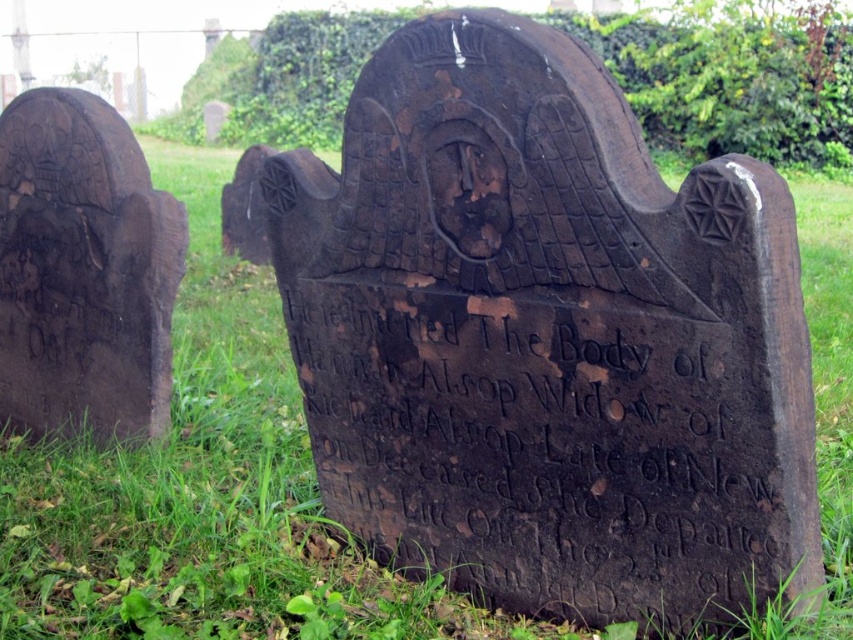
You are standing in a cemetery and notice the black stone inscription at center and the dark brown wood at left. Which object is closer to you?

The black stone inscription at center is closer to you because it is in front of the dark brown wood at left.

You are standing in front of the gravestone and want to locate the black stone inscription at center. Where should you look relative to the gravestone?

The black stone inscription at center is located at point [544,445] on the gravestone, which is approximately the lower central area of the gravestone.